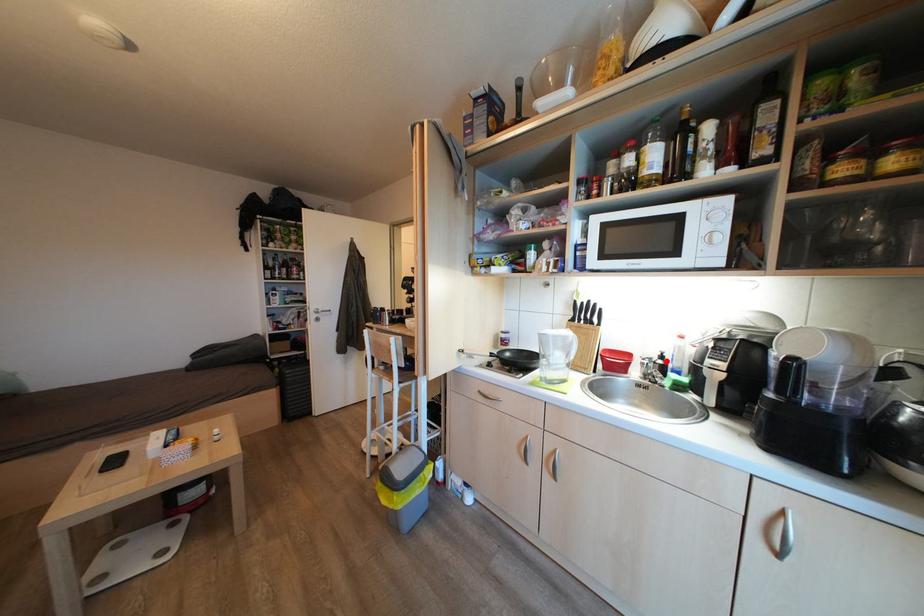
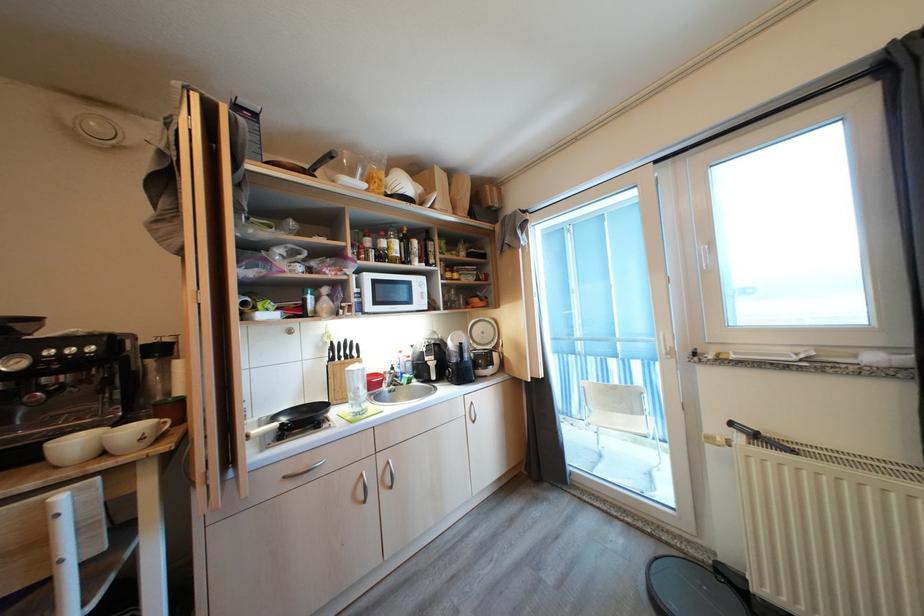
Question: I am providing you with two images of the same scene from different viewpoints. A red point is marked on the first image. Can you still see the location of the red point in image 2?

Choices:
 (A) Yes
 (B) No

Answer: (A)